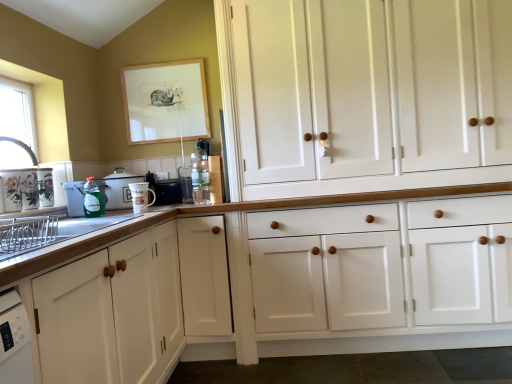
This screenshot has height=384, width=512. Identify the location of free space above black plastic toaster at center, which is the second appliance in right-to-left order (from a real-world perspective). (172, 172).